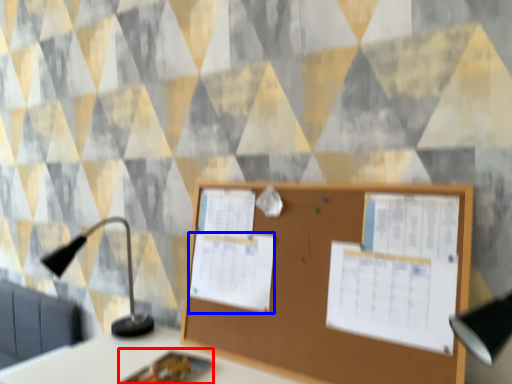
Question: Which object is closer to the camera taking this photo, notebook (highlighted by a red box) or poster (highlighted by a blue box)?

Choices:
 (A) notebook
 (B) poster

Answer: (A)